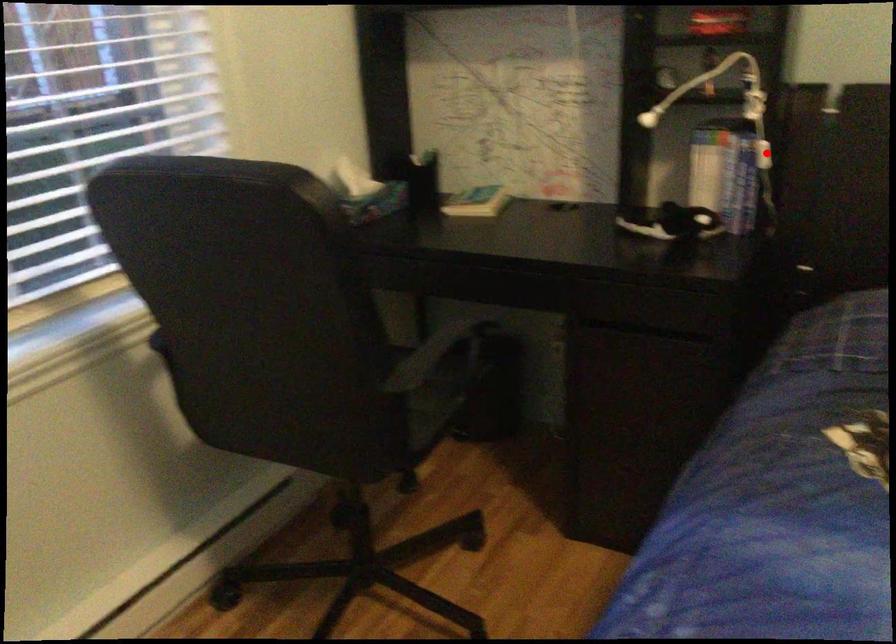
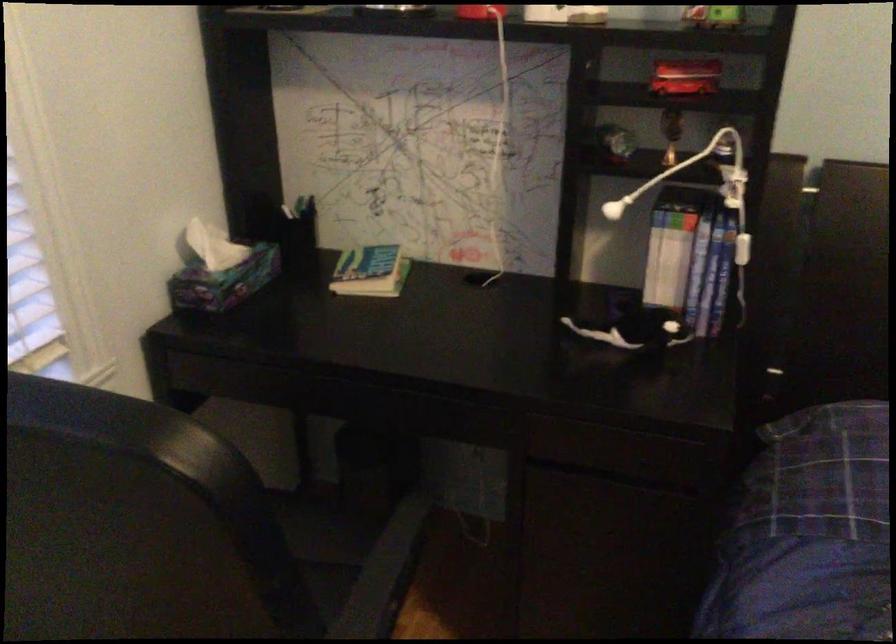
Question: I am providing you with two images of the same scene from different viewpoints. In image1, a red point is highlighted. Considering the same 3D point in image2, which of the following is correct?

Choices:
 (A) It is closer
 (B) It is farther

Answer: (A)